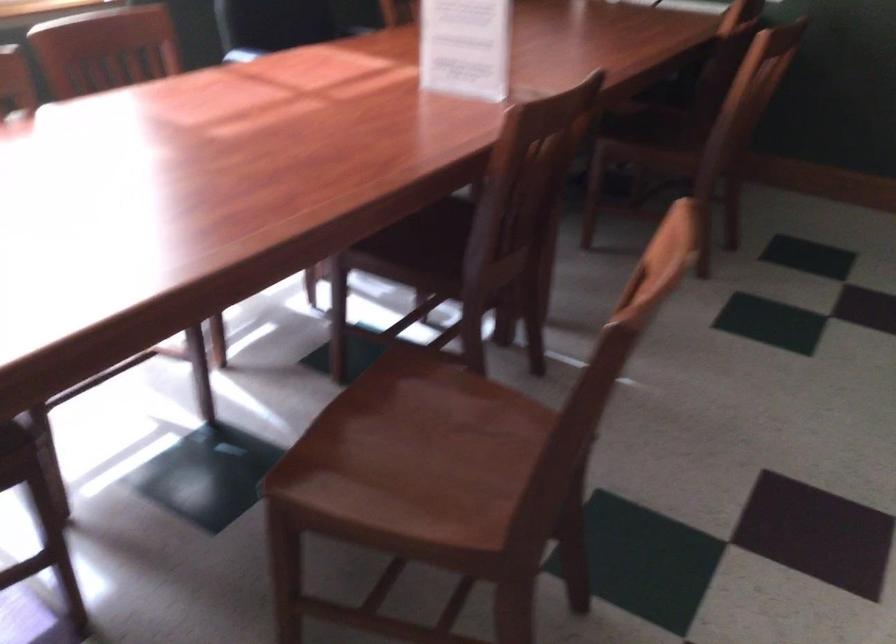
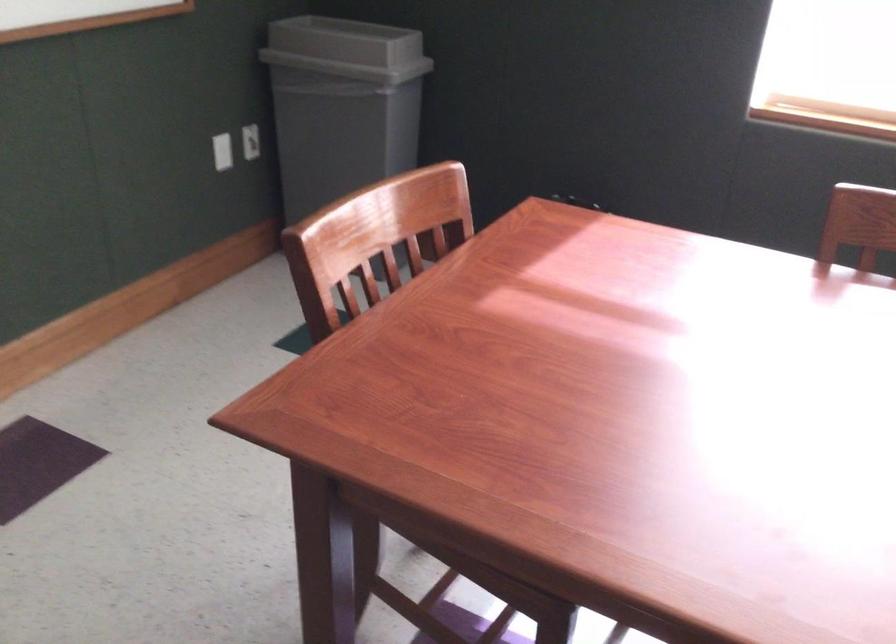
Based on the continuous images, in which direction is the camera rotating?

The rotation direction of the camera is left-down.